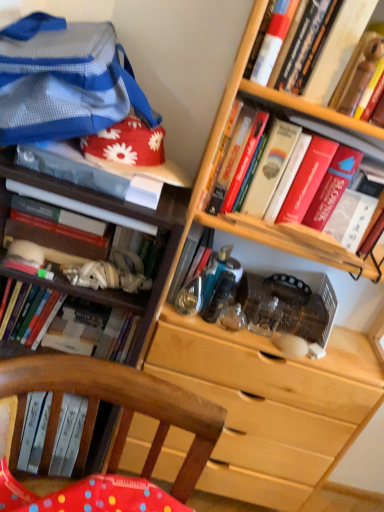
Locate an element on the screen. The width and height of the screenshot is (384, 512). vacant space behind hardcover book at upper right, which is counted as the 1th book, starting from the right is located at coordinates (325, 129).